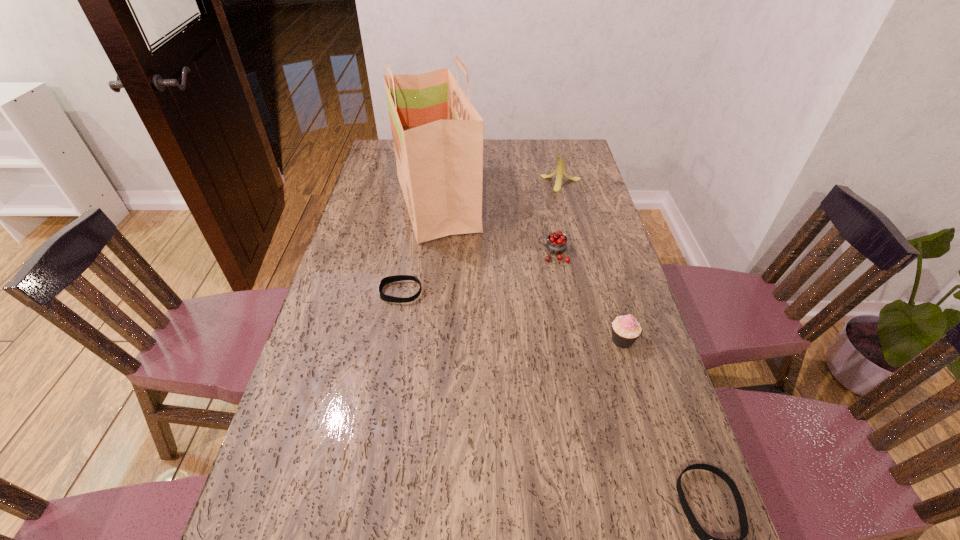
Please mark a free spot for a new wristband to balance the arrangement. Please provide its 2D coordinates. Your answer should be formatted as a tuple, i.e. [(x, y)], where the tuple contains the x and y coordinates of a point satisfying the conditions above.

[(524, 379)]